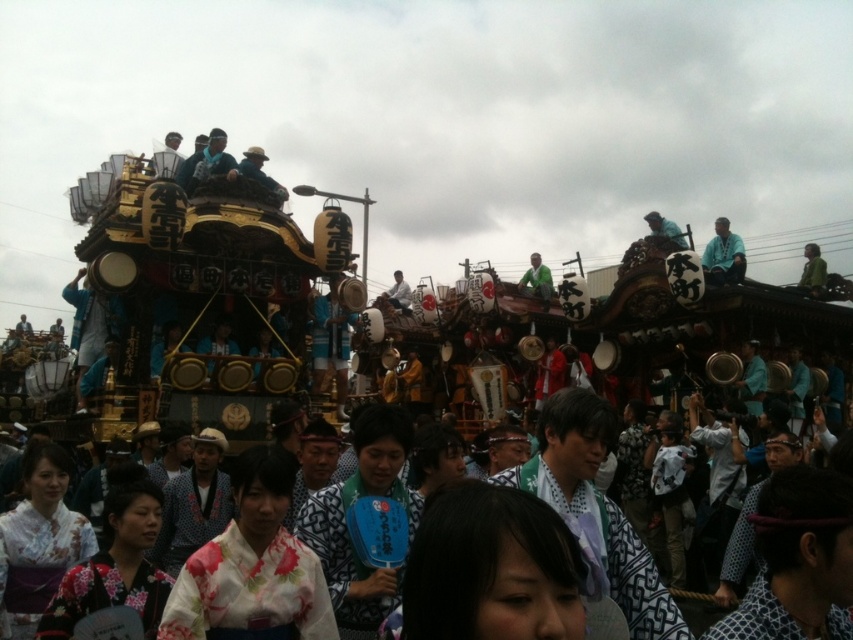
In the festival scene, there is a floral kimono at center and a blue fabric hat at upper center. From the perspective of someone standing in front of the float, which object is positioned to the left?

The floral kimono at center is to the left of the blue fabric hat at upper center.

Based on the photo, you are standing in the crowd at the festival and want to take a photo of the float. You notice two points marked in the scene. The first point is at coordinates point (x=167, y=602) and the second point is at coordinates point (x=672, y=225). Which point is closer to you?

Point (x=167, y=602) is in front of point (x=672, y=225), so the first point is closer to you.